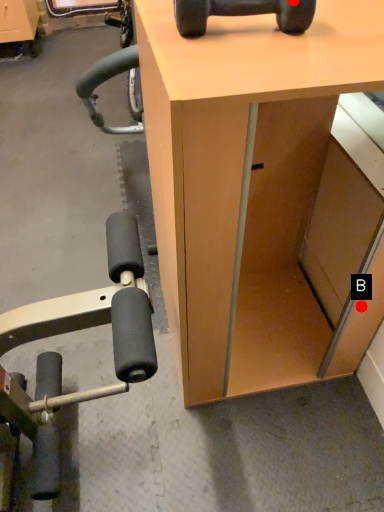
Question: Two points are circled on the image, labeled by A and B beside each circle. Among these points, which one is farthest from the camera?

Choices:
 (A) A is further
 (B) B is further

Answer: (B)